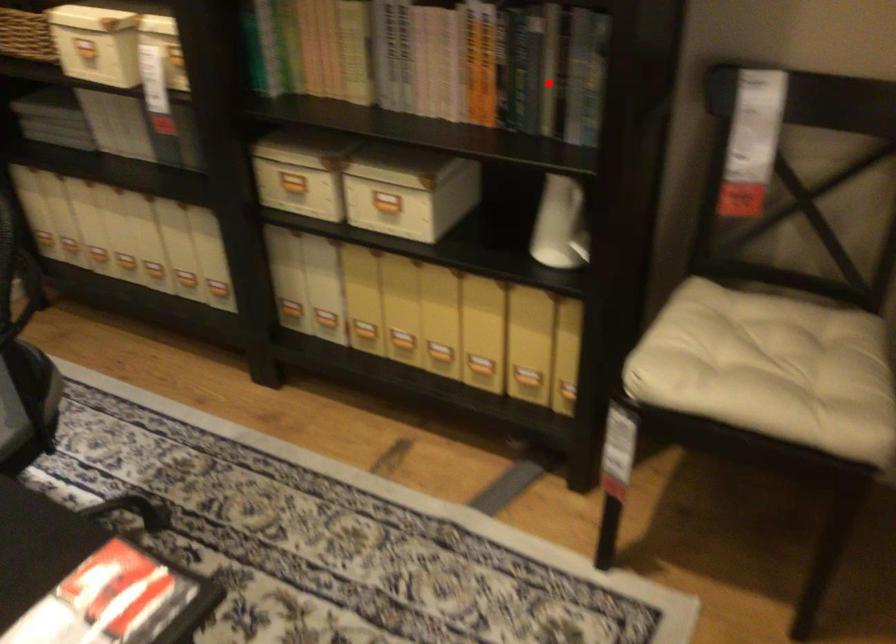
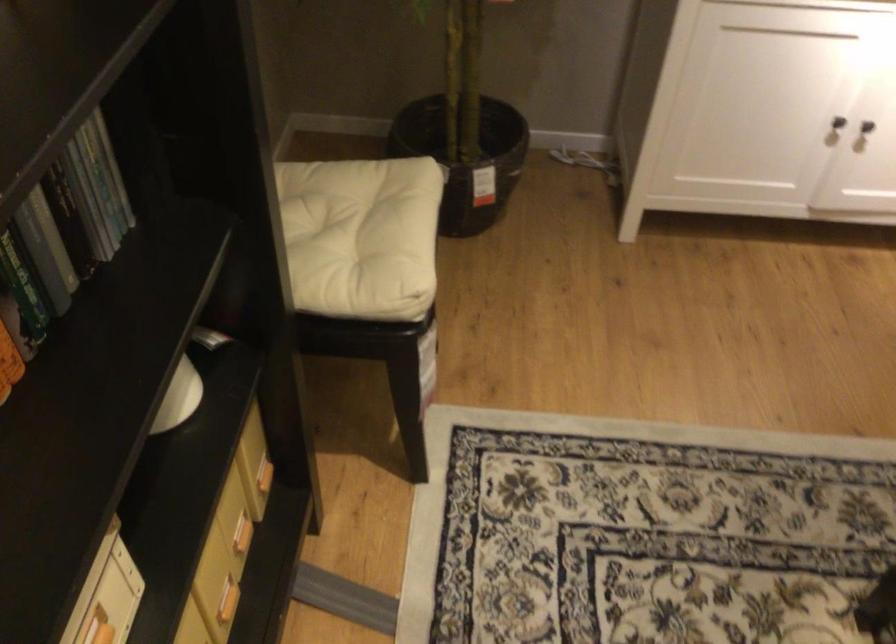
Find the pixel in the second image that matches the highlighted location in the first image.

(30, 240)